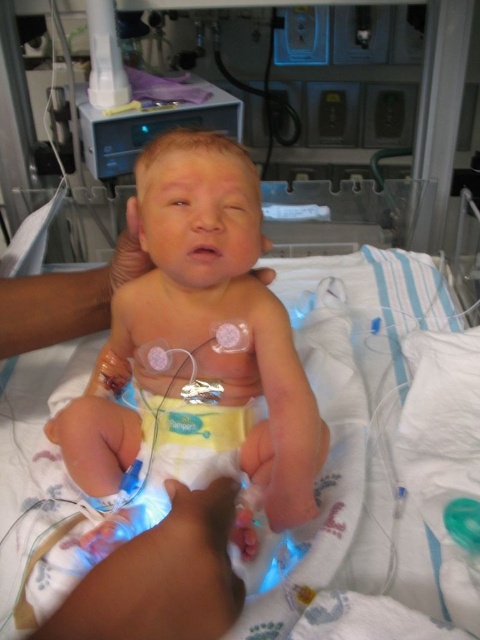
Question: Which point appears closest to the camera in this image?

Choices:
 (A) (147, 563)
 (B) (393, 256)
 (C) (255, 476)

Answer: (A)

Question: Where is smooth skin newborn at center located in relation to white soft hospital bed at center in the image?

Choices:
 (A) above
 (B) below

Answer: (A)

Question: Which is farther from the white soft hospital bed at center?

Choices:
 (A) white soft hand at lower center
 (B) smooth skin newborn at center

Answer: (A)

Question: Considering the relative positions of smooth skin newborn at center and white soft hospital bed at center in the image provided, where is smooth skin newborn at center located with respect to white soft hospital bed at center?

Choices:
 (A) right
 (B) left

Answer: (B)

Question: Which object is farther from the camera taking this photo?

Choices:
 (A) smooth skin newborn at center
 (B) white soft hospital bed at center
 (C) white soft hand at lower center

Answer: (A)

Question: Can you confirm if smooth skin newborn at center is smaller than white soft hospital bed at center?

Choices:
 (A) yes
 (B) no

Answer: (A)